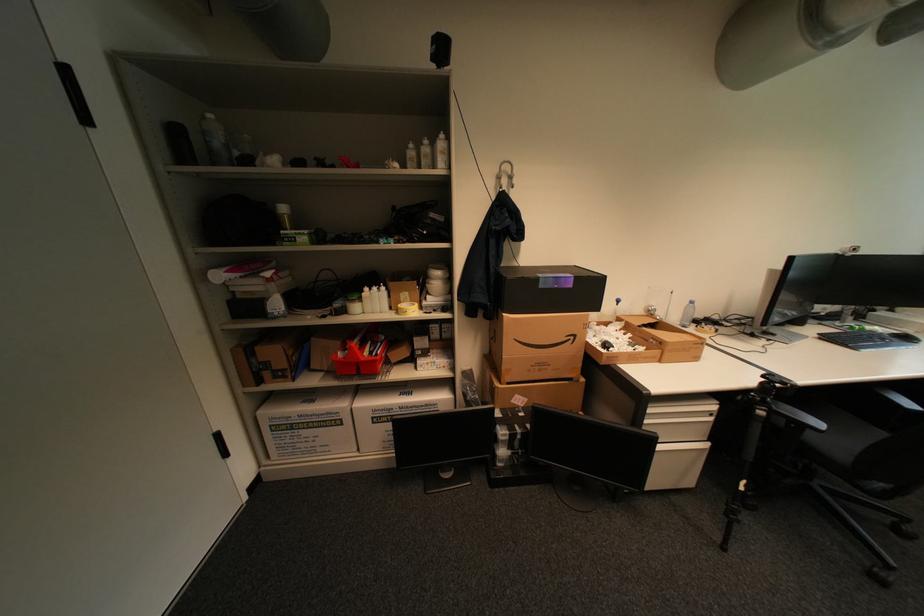
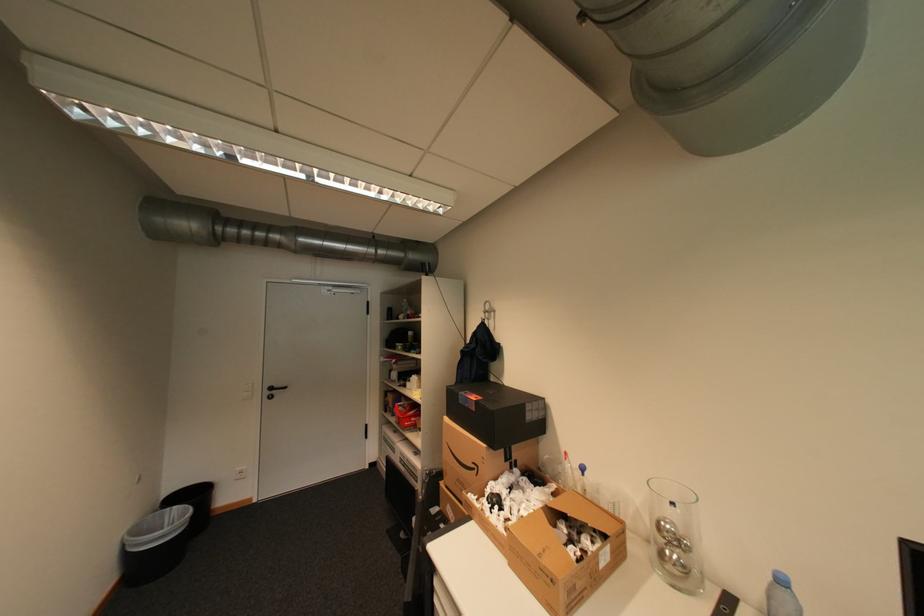
Find the pixel in the second image that matches point (699, 302) in the first image.

(791, 582)